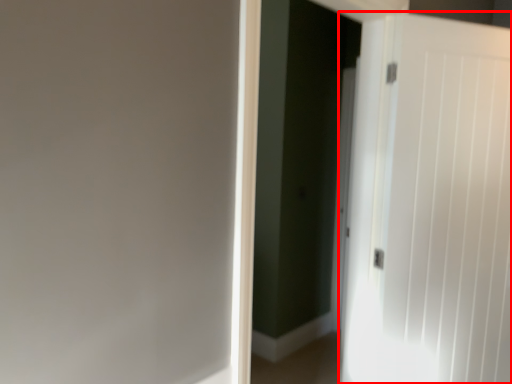
Question: From the image's perspective, what is the correct spatial relationship of door (annotated by the red box) in relation to screen door?

Choices:
 (A) below
 (B) above

Answer: (A)